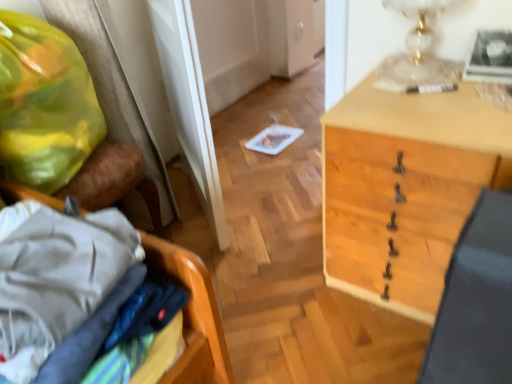
The image size is (512, 384). I want to click on vacant space to the left of wooden desk at center, so click(283, 284).